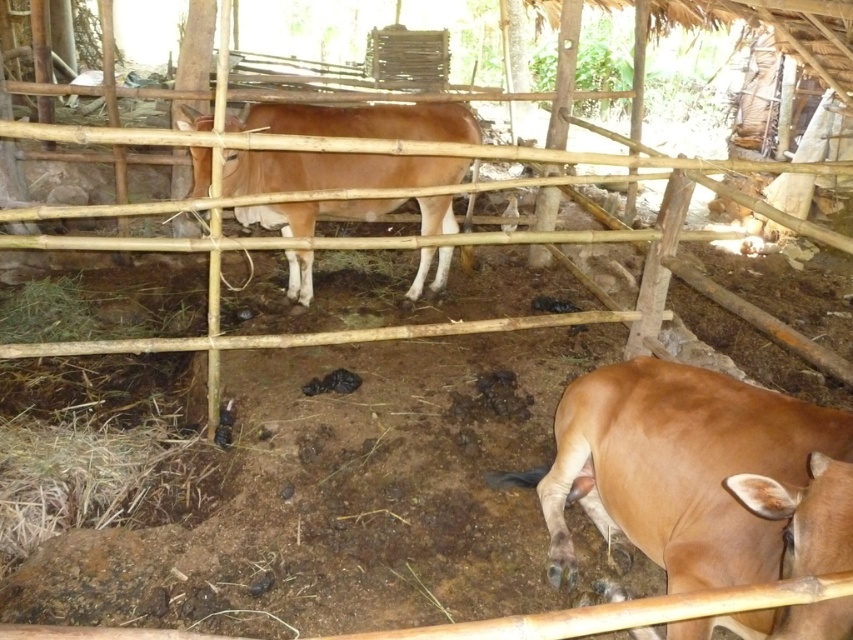
Is brown matte cow at lower right positioned behind brown matte cow at center?

No.

Is brown matte cow at lower right taller than brown matte cow at center?

In fact, brown matte cow at lower right may be shorter than brown matte cow at center.

You are a GUI agent. You are given a task and a screenshot of the screen. Output one action in this format:
    pyautogui.click(x=<x>, y=<y>)
    Task: Click on the brown matte cow at lower right
    
    Given the screenshot: What is the action you would take?
    pyautogui.click(x=699, y=474)

Find the location of a particular element. This screenshot has width=853, height=640. brown matte cow at lower right is located at coordinates (699, 474).